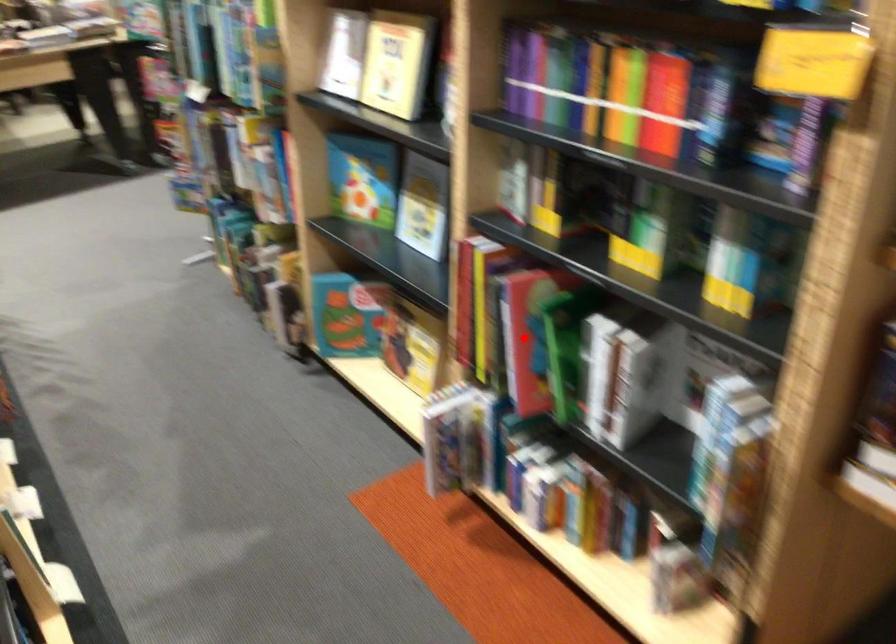
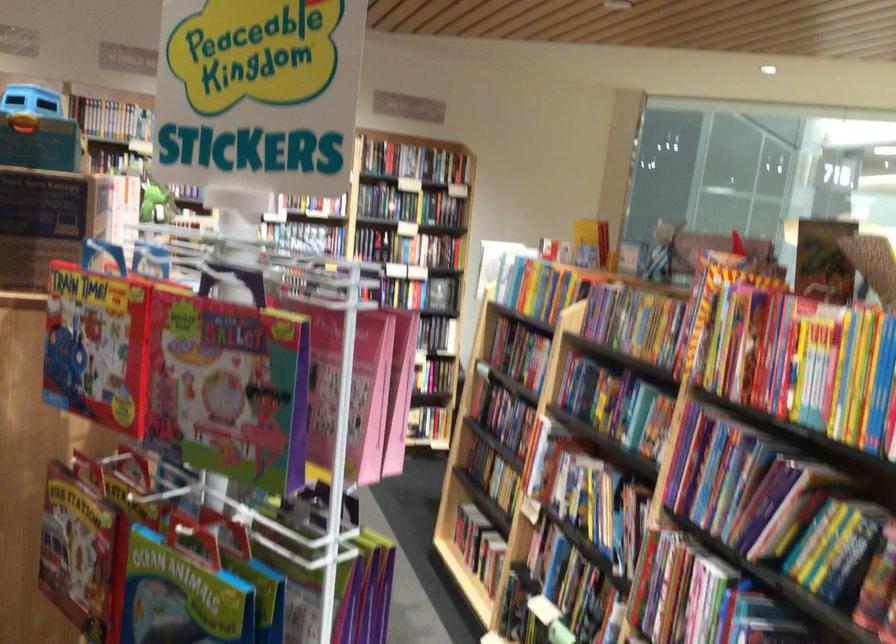
Question: I am providing you with two images of the same scene from different viewpoints. A red point is marked on the first image. Is the red point's position out of view in image 2?

Choices:
 (A) Yes
 (B) No

Answer: (A)